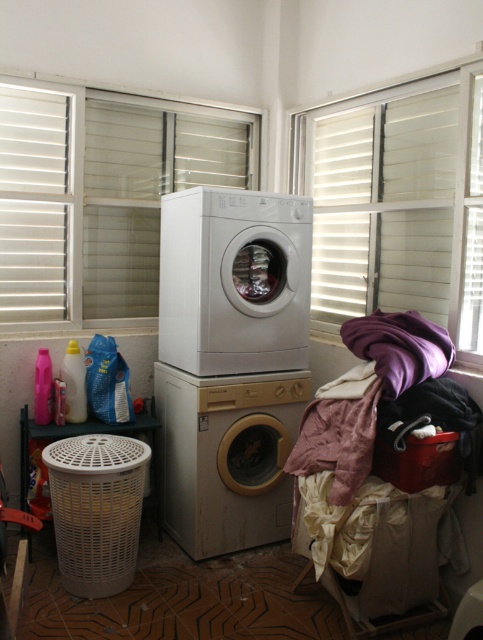
Looking at this image, does beige wood washing machine at center have a lesser width compared to red plastic basket at lower right?

No, beige wood washing machine at center is not thinner than red plastic basket at lower right.

Can you confirm if beige wood washing machine at center is wider than red plastic basket at lower right?

Yes, beige wood washing machine at center is wider than red plastic basket at lower right.

Find the location of a particular element. beige wood washing machine at center is located at coordinates (227, 456).

Which is in front, point (374, 243) or point (440, 456)?

Positioned in front is point (440, 456).

Is white/textured blinds at upper right below red plastic basket at lower right?

No, white/textured blinds at upper right is not below red plastic basket at lower right.

Where is `white/textured blinds at upper right`? The width and height of the screenshot is (483, 640). white/textured blinds at upper right is located at coordinates (397, 200).

At what (x,y) coordinates should I click in order to perform the action: click on white/textured blinds at upper right. Please return your answer as a coordinate pair (x, y). Image resolution: width=483 pixels, height=640 pixels. Looking at the image, I should click on (397, 200).

Is white/textured blinds at upper right wider than beige wood washing machine at center?

No.

Between point (402, 198) and point (207, 436), which one is positioned behind?

Positioned behind is point (402, 198).

What are the coordinates of `white/textured blinds at upper right` in the screenshot? It's located at (397, 200).